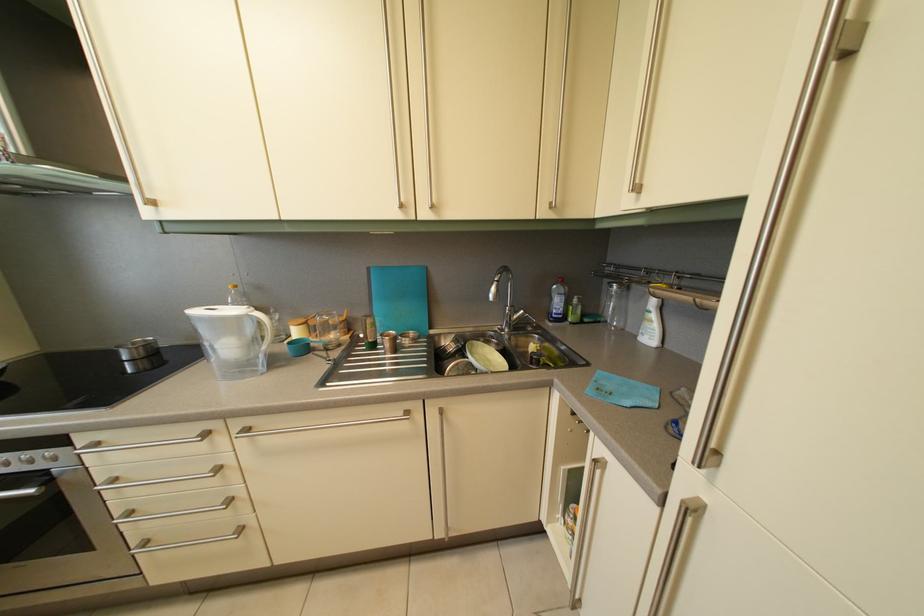
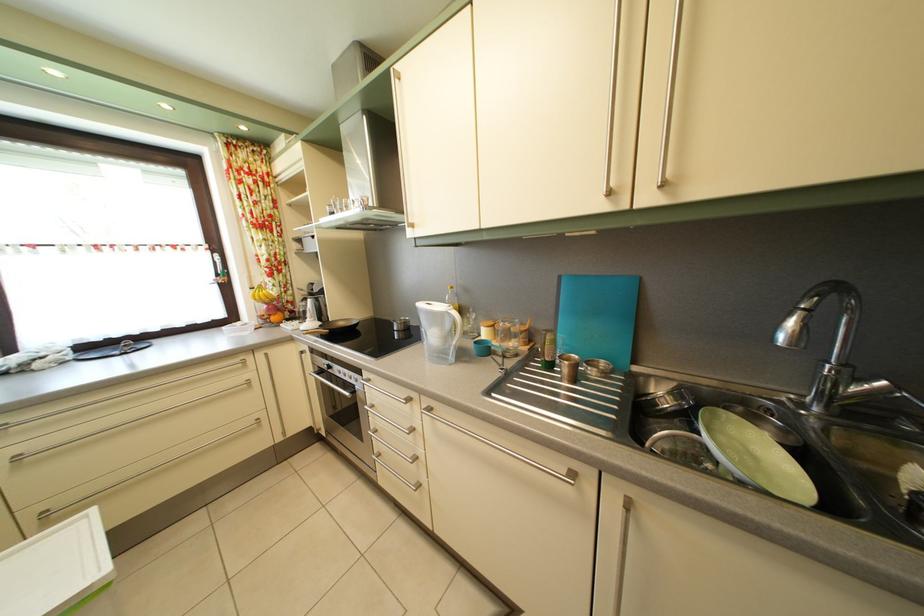
Question: The camera is either moving clockwise (left) or counter-clockwise (right) around the object. The first image is from the beginning of the video and the second image is from the end. Is the camera moving left or right when shooting the video?

Choices:
 (A) Left
 (B) Right

Answer: (B)